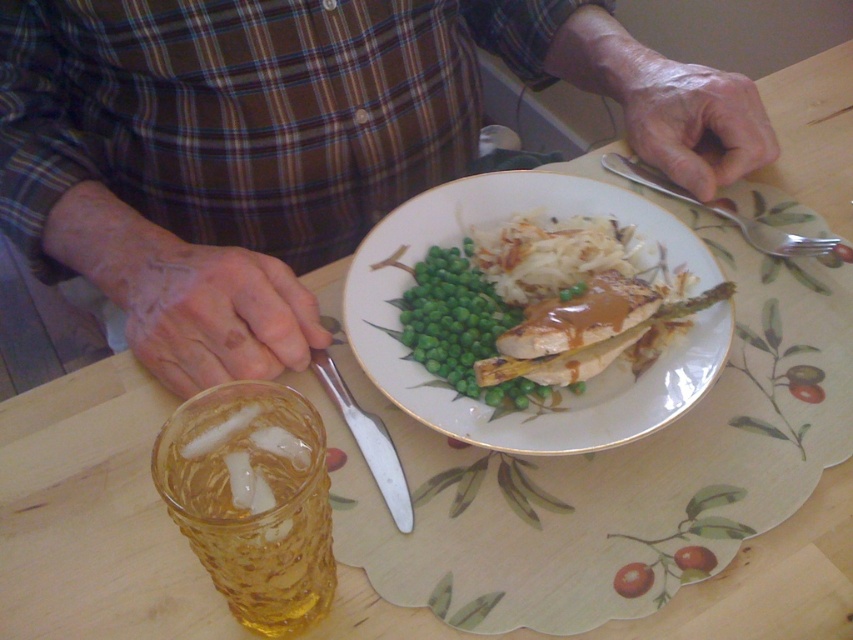
You are sitting at the wooden table and want to pick up the silver spoon at upper right. Which direction should you reach from the brown plaid shirt at center?

The brown plaid shirt at center is to the left of the silver spoon at upper right, so you should reach to the right from the brown plaid shirt at center to pick up the silver spoon at upper right.

You are a chef preparing to serve a meal. You see the brown plaid shirt at center and the silver metallic knife at center on the table. Which object is closer to the edge of the table?

The silver metallic knife at center is closer to the edge of the table because it is shorter than the brown plaid shirt at center, which is taller and likely occupies more space towards the center.

What is the color and pattern of the shirt located at point (288, 145) on the image?

The shirt at point (288, 145) is brown in color and has a plaid pattern.